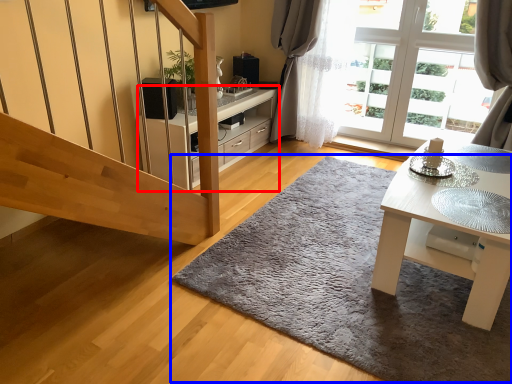
Question: Which object is closer to the camera taking this photo, cabinetry (highlighted by a red box) or doormat (highlighted by a blue box)?

Choices:
 (A) cabinetry
 (B) doormat

Answer: (B)